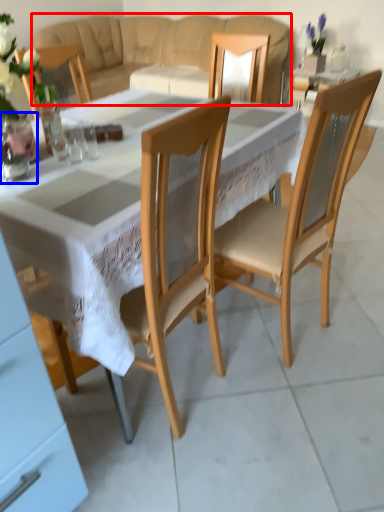
Question: Which object is closer to the camera taking this photo, studio couch (highlighted by a red box) or vase (highlighted by a blue box)?

Choices:
 (A) studio couch
 (B) vase

Answer: (B)